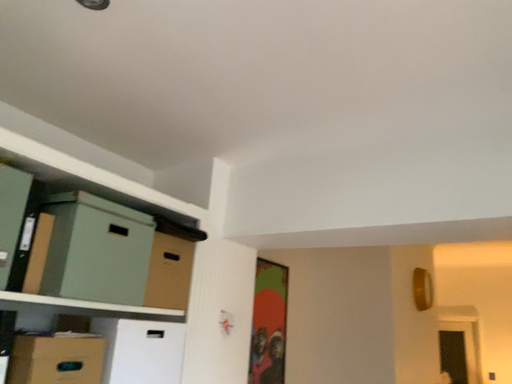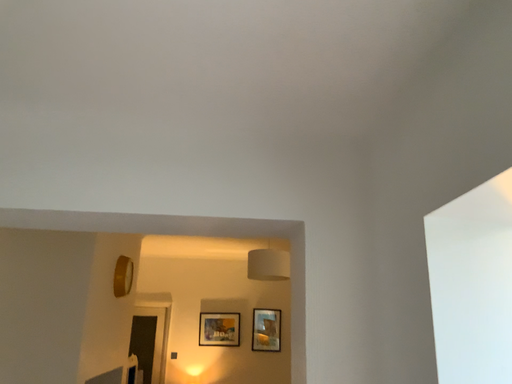
Question: How did the camera likely rotate when shooting the video?

Choices:
 (A) rotated right
 (B) rotated left

Answer: (A)